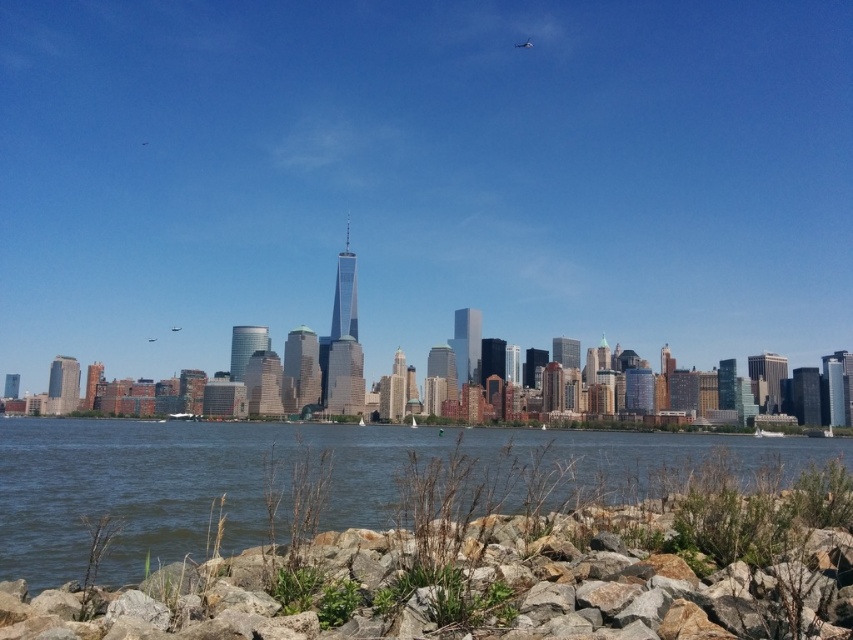
You are standing on the rocky shore at lower center and want to reach the clear water at lower center. Which direction should you move to get to the water?

You should move downward since the rocky shore at lower center is located above clear water at lower center.

You are a photographer planning to capture the rocky shore at lower center and the clear water at lower center in a single frame. Based on their sizes, which object will occupy more of the foreground in your photo?

The clear water at lower center will occupy more of the foreground in the photo since it is larger than the rocky shore at lower center.